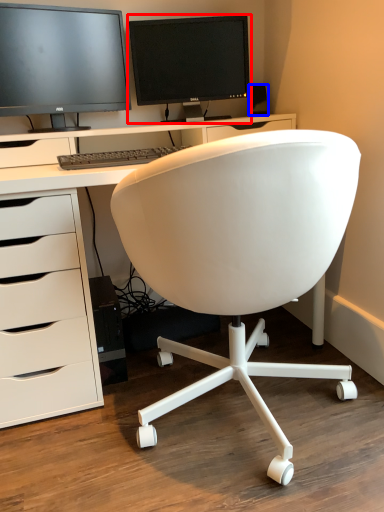
Question: Among these objects, which one is nearest to the camera, computer monitor (highlighted by a red box) or office supplies (highlighted by a blue box)?

Choices:
 (A) computer monitor
 (B) office supplies

Answer: (A)